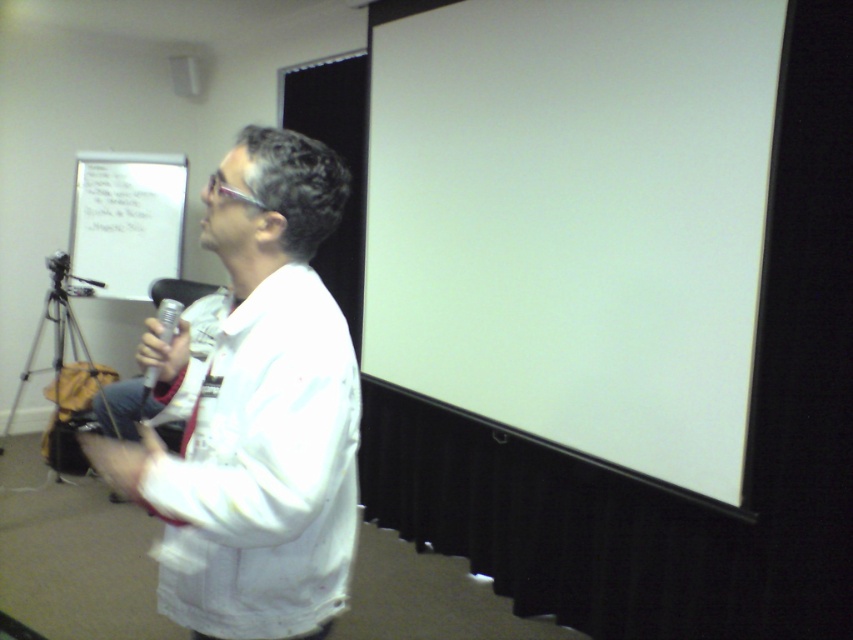
You are an attendee at a presentation and want to move from the flip chart to the projection screen. The flip chart is at point (540, 124) and the projection screen is at point (175, 330). Which direction should you move to reach the projection screen?

You should move towards the point (175, 330), which is closer to you than the flip chart at point (540, 124), so moving forward towards the projection screen would be the correct direction.

You are an event organizer setting up for a presentation. You need to place a new projector that requires a clear line of sight to the projection screen on the right. The projector must be placed between the white paper at upper left and the silver metallic tripod at lower left. Is there enough space between them for the projector?

The white paper at upper left is to the right of the silver metallic tripod at lower left, so there is space between them for the projector as long as it fits within that area.